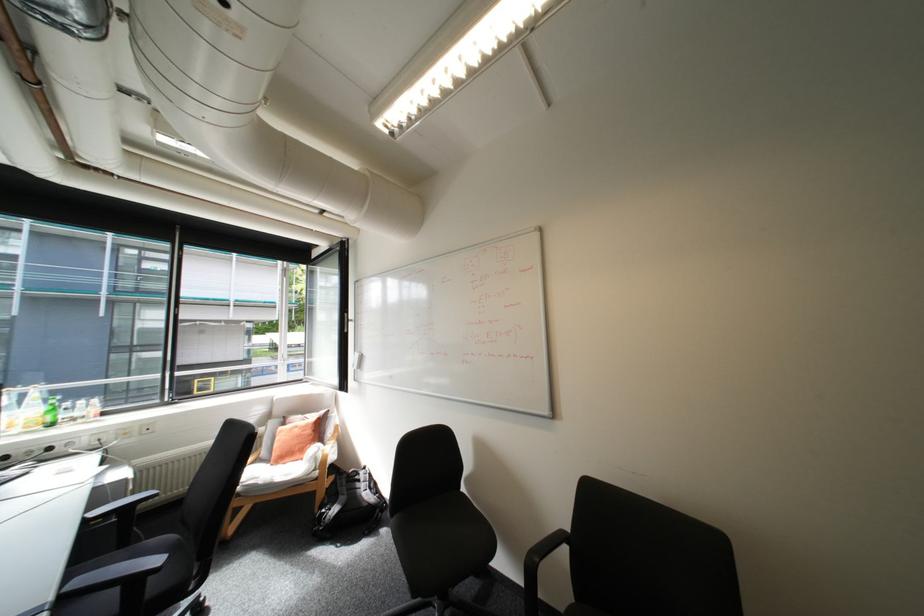
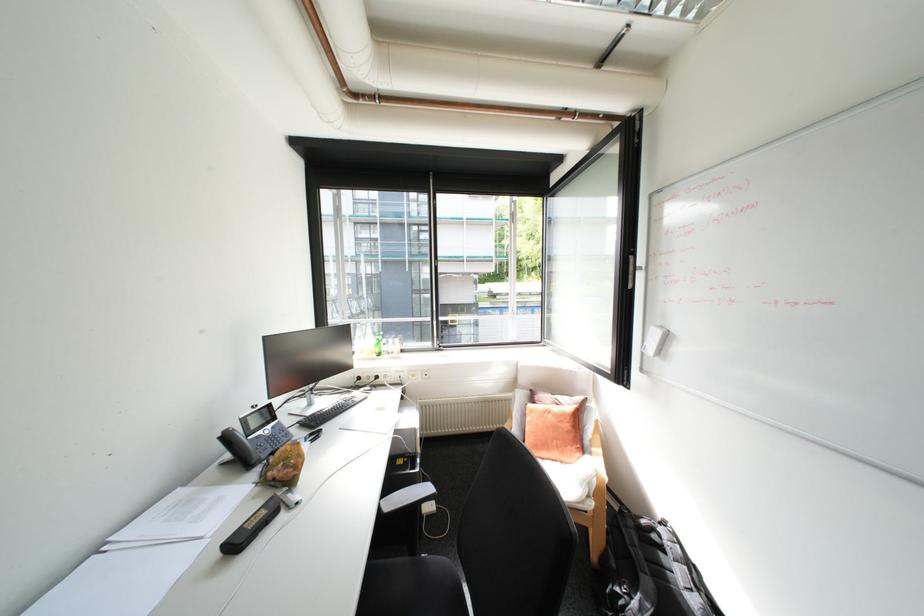
Where in the second image is the point corresponding to pixel 137 480 from the first image?

(424, 429)